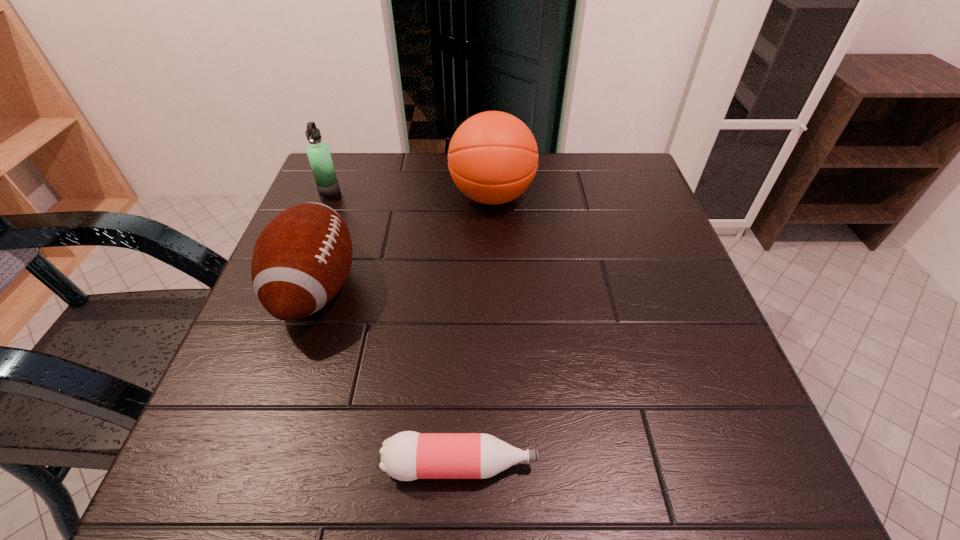
This screenshot has height=540, width=960. In order to click on object that is the third closest to the basketball in this screenshot , I will do [x=406, y=456].

Locate an element on the screen. free space that satisfies the following two spatial constraints: 1. on the front side of the basketball; 2. with the cap open on the shortest object is located at coordinates (501, 465).